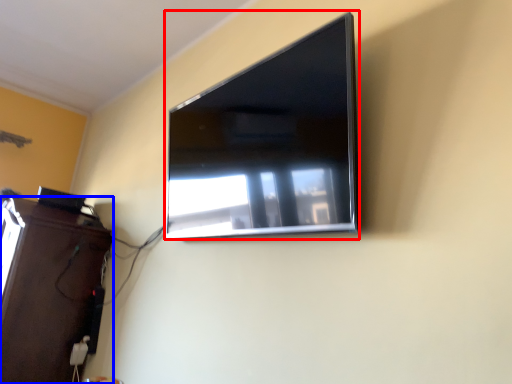
Question: Which object appears farthest to the camera in this image, television (highlighted by a red box) or furniture (highlighted by a blue box)?

Choices:
 (A) television
 (B) furniture

Answer: (B)